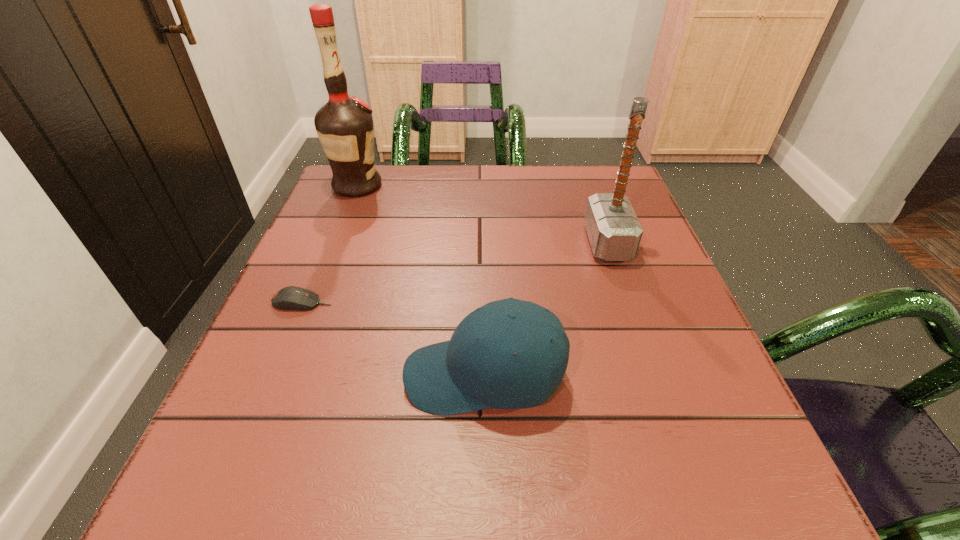
Locate an element on the screen. This screenshot has height=540, width=960. vacant region located on the striking surface of the rightmost object is located at coordinates (504, 243).

The width and height of the screenshot is (960, 540). Find the location of `blank space located on the striking surface of the rightmost object`. blank space located on the striking surface of the rightmost object is located at coordinates (448, 243).

Locate an element on the screen. This screenshot has height=540, width=960. vacant point located on the front-facing side of the second shortest object is located at coordinates (323, 376).

Locate an element on the screen. free spot located on the front-facing side of the second shortest object is located at coordinates (367, 376).

Identify the location of free space located on the front-facing side of the second shortest object. (342, 376).

Locate an element on the screen. The image size is (960, 540). free spot located 0.070m on the back of the computer mouse is located at coordinates (316, 268).

Image resolution: width=960 pixels, height=540 pixels. In order to click on object located at the far edge in this screenshot , I will do `click(344, 125)`.

Image resolution: width=960 pixels, height=540 pixels. I want to click on liquor that is at the left edge, so click(x=344, y=125).

Where is `computer mouse that is at the left edge`? computer mouse that is at the left edge is located at coordinates (289, 298).

Identify the location of object that is at the right edge. (614, 231).